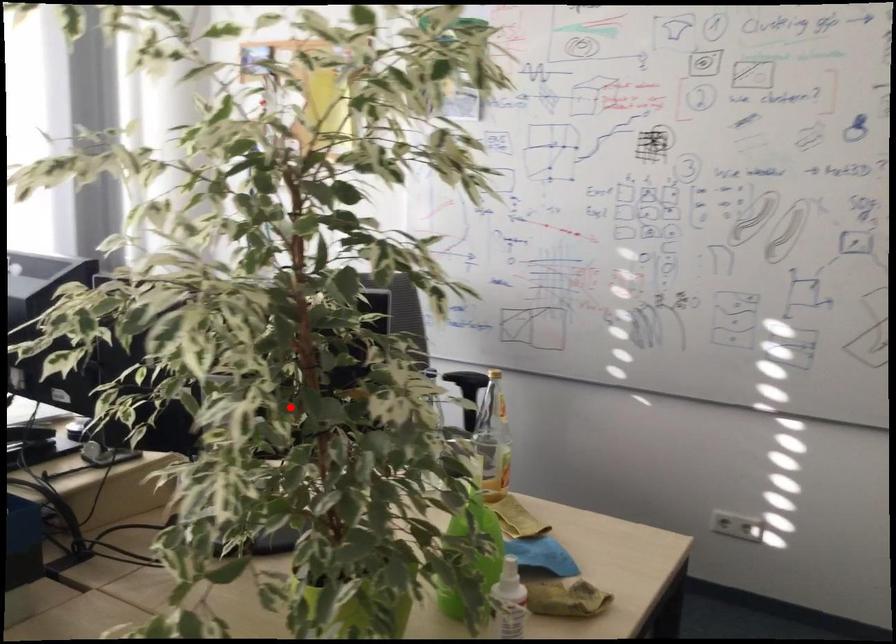
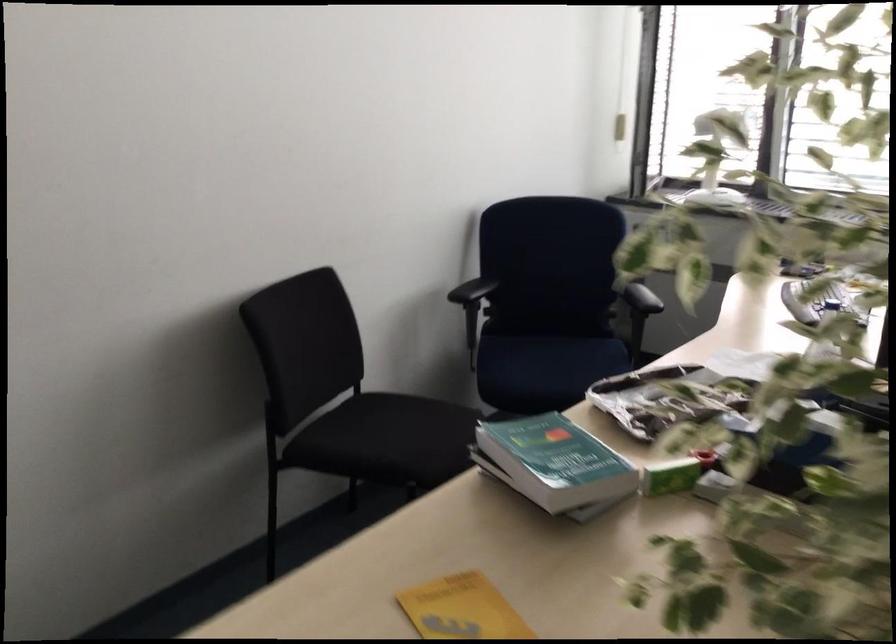
Question: A red point is marked in image1. In image2, is the corresponding 3D point closer to the camera or farther? Reply with the corresponding letter.

Choices:
 (A) The corresponding 3D point is closer.
 (B) The corresponding 3D point is farther.

Answer: (A)